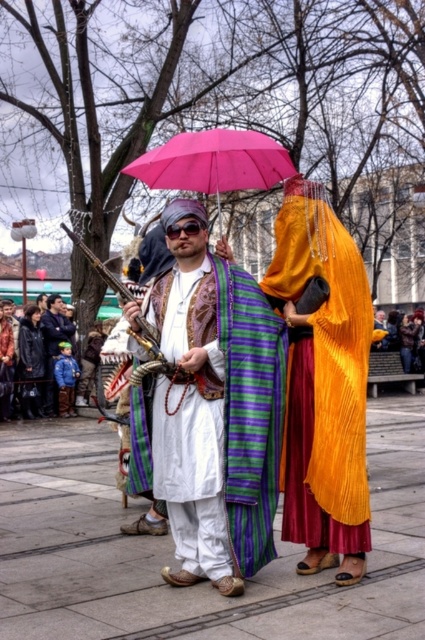
Question: Which of the following is the farthest from the observer?

Choices:
 (A) blue denim jacket at lower left
 (B) smooth concrete pavement at center
 (C) leather jacket at center

Answer: (C)

Question: Considering the relative positions of shiny gold fabric at center and leather jacket at center in the image provided, where is shiny gold fabric at center located with respect to leather jacket at center?

Choices:
 (A) above
 (B) below

Answer: (B)

Question: Is smooth concrete pavement at center positioned in front of leather jacket at lower left?

Choices:
 (A) yes
 (B) no

Answer: (A)

Question: Which of the following is the farthest from the observer?

Choices:
 (A) (419, 324)
 (B) (139, 164)
 (C) (204, 220)
 (D) (385, 632)

Answer: (A)

Question: Estimate the real-world distances between objects in this image. Which object is farther from the matte purple striped robe at center?

Choices:
 (A) smooth concrete pavement at center
 (B) shiny gold fabric at center
 (C) leather jacket at center

Answer: (C)

Question: Does shiny gold fabric at center have a smaller size compared to leather jacket at center?

Choices:
 (A) yes
 (B) no

Answer: (A)